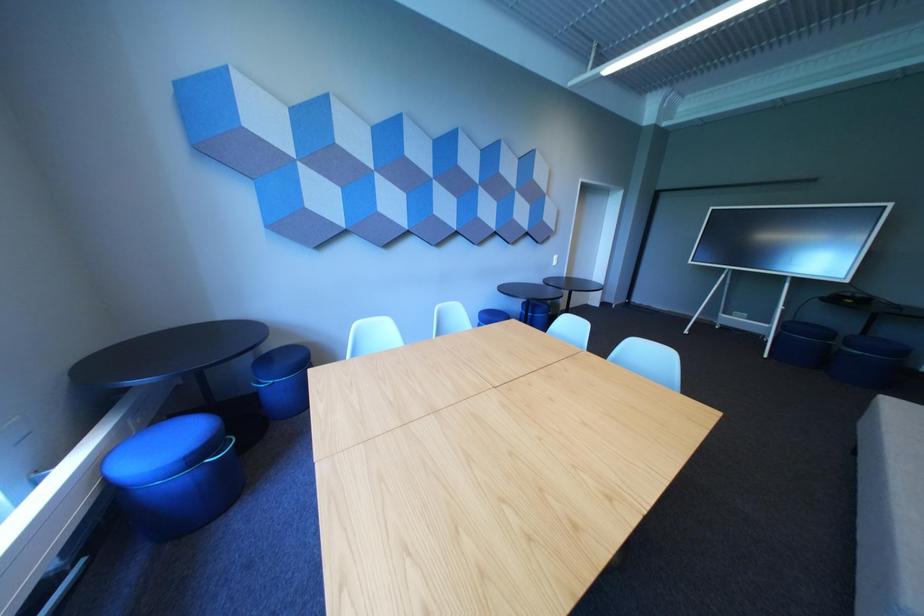
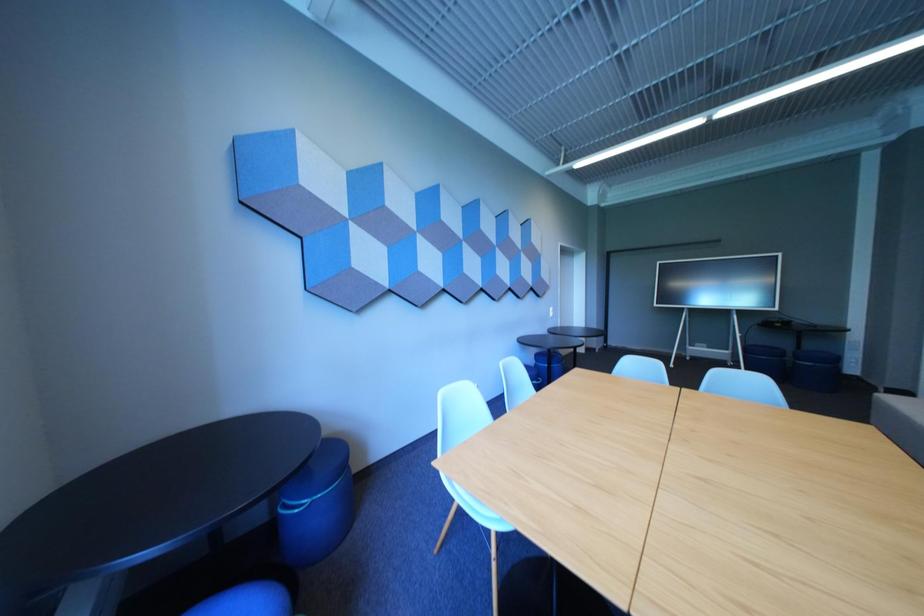
Question: Which direction would the cameraman need to move to produce the second image? Reply with the corresponding letter.

Choices:
 (A) Left
 (B) Right
 (C) Forward
 (D) Backward

Answer: (A)